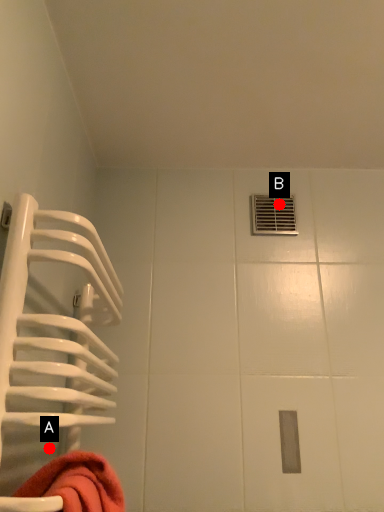
Question: Two points are circled on the image, labeled by A and B beside each circle. Which point is farther from the camera taking this photo?

Choices:
 (A) A is further
 (B) B is further

Answer: (B)